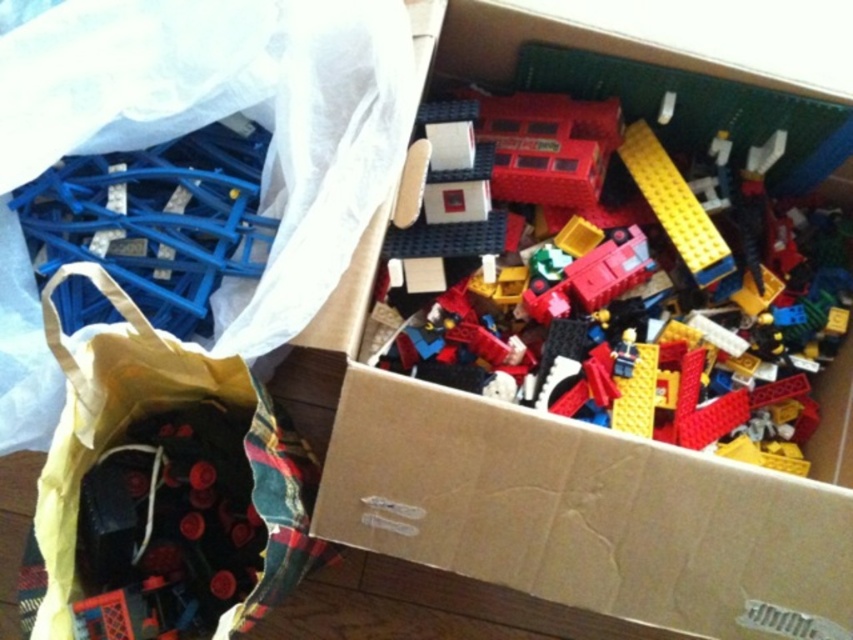
Question: Can you confirm if cardboard box at upper center is thinner than black fabric bag at lower left?

Choices:
 (A) yes
 (B) no

Answer: (B)

Question: Which point is farther to the camera?

Choices:
 (A) (404, 500)
 (B) (103, 346)

Answer: (A)

Question: Which object is farther from the camera taking this photo?

Choices:
 (A) cardboard box at upper center
 (B) black fabric bag at lower left

Answer: (A)

Question: From the image, what is the correct spatial relationship of cardboard box at upper center in relation to black fabric bag at lower left?

Choices:
 (A) left
 (B) right

Answer: (B)

Question: Is cardboard box at upper center positioned before black fabric bag at lower left?

Choices:
 (A) yes
 (B) no

Answer: (B)